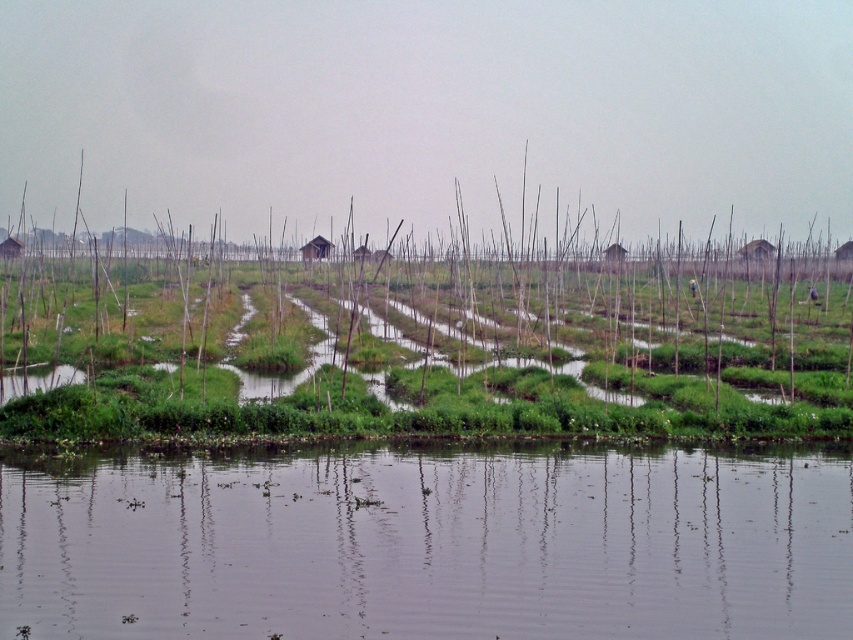
Question: Which of the following is the farthest from the observer?

Choices:
 (A) (96, 349)
 (B) (468, 468)

Answer: (A)

Question: Is clear water at lower center below green grassy reed at center?

Choices:
 (A) no
 (B) yes

Answer: (B)

Question: Can you confirm if clear water at lower center is positioned to the right of green grassy reed at center?

Choices:
 (A) no
 (B) yes

Answer: (B)

Question: Does clear water at lower center appear on the left side of green grassy reed at center?

Choices:
 (A) yes
 (B) no

Answer: (B)